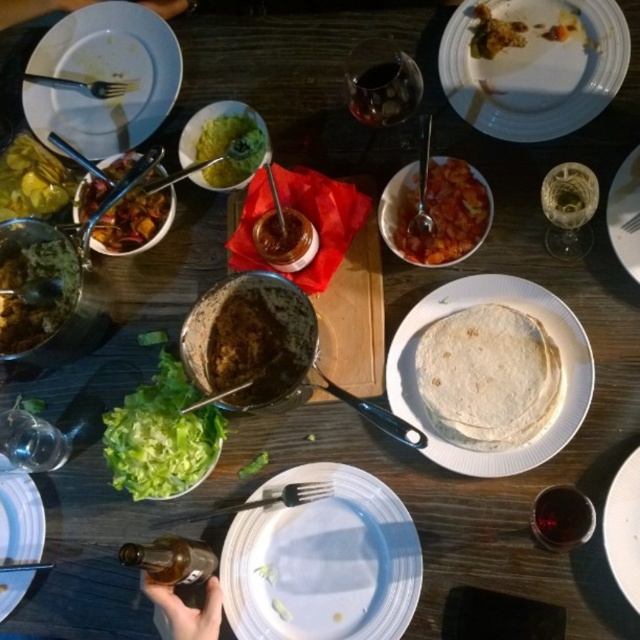
Question: Is transparent glass at upper right behind white matte plate at upper right?

Choices:
 (A) yes
 (B) no

Answer: (B)

Question: Based on their relative distances, which object is nearer to the satin silver spoon at upper center?

Choices:
 (A) transparent glass at upper center
 (B) green matte salsa at lower left
 (C) shiny green pickles at upper left

Answer: (A)

Question: Which object appears farthest from the camera in this image?

Choices:
 (A) white matte plate at upper left
 (B) green matte guacamole at upper center
 (C) white matte tortilla at center
 (D) crumbly brown bread at upper right

Answer: (A)

Question: Is white matte plate at upper left smaller than silver fork at upper left?

Choices:
 (A) yes
 (B) no

Answer: (B)

Question: Is shiny metallic bowl at upper left to the left of white matte plate at lower left from the viewer's perspective?

Choices:
 (A) no
 (B) yes

Answer: (A)

Question: Which point appears farthest from the camera in this image?

Choices:
 (A) (552, 90)
 (B) (19, 524)
 (C) (250, 280)

Answer: (B)